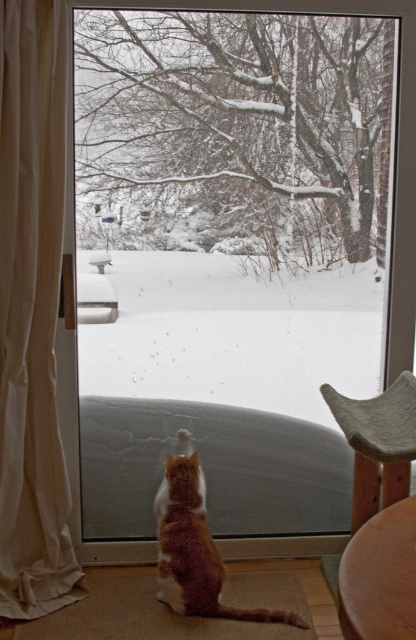
Question: Which point appears farthest from the camera in this image?

Choices:
 (A) (42, 108)
 (B) (284, 364)
 (C) (379, 477)

Answer: (B)

Question: Can you confirm if transparent glass screen door at center is positioned to the left of white fabric curtain at left?

Choices:
 (A) yes
 (B) no

Answer: (B)

Question: From the image, what is the correct spatial relationship of transparent glass screen door at center in relation to orange fur cat at center?

Choices:
 (A) right
 (B) left

Answer: (A)

Question: Can you confirm if transparent glass screen door at center is positioned above white fabric curtain at left?

Choices:
 (A) yes
 (B) no

Answer: (A)

Question: Which of the following is the farthest from the observer?

Choices:
 (A) (15, 314)
 (B) (403, 467)

Answer: (A)

Question: Which of these objects is positioned closest to the transparent glass screen door at center?

Choices:
 (A) orange fur cat at center
 (B) white fabric curtain at left

Answer: (B)